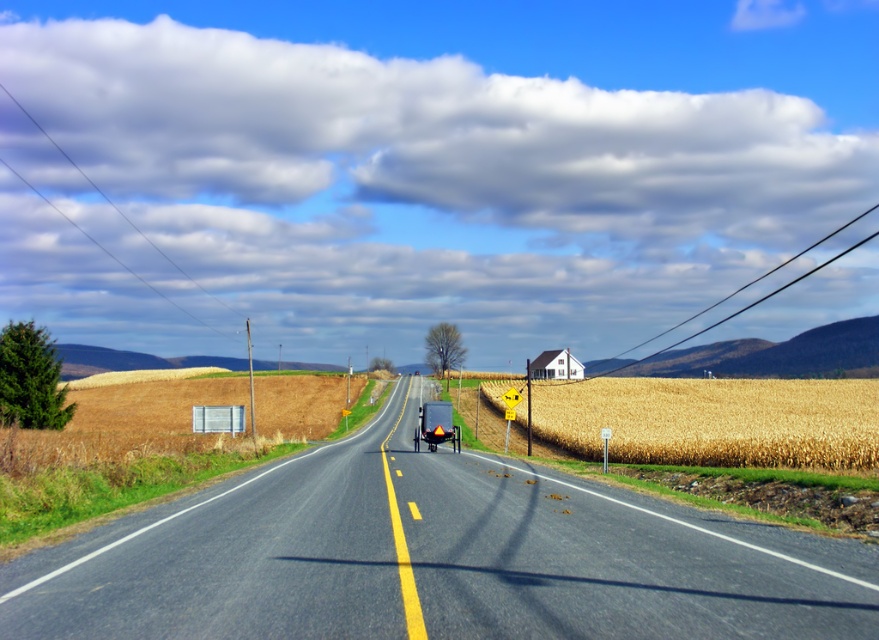
Describe the element at coordinates (434, 557) in the screenshot. The image size is (879, 640). I see `asphalt road at center` at that location.

Is point (379, 502) behind point (519, 420)?

No, it is in front of (519, 420).

You are a GUI agent. You are given a task and a screenshot of the screen. Output one action in this format:
    pyautogui.click(x=<x>, y=<y>)
    Task: Click on the asphalt road at center
    The height and width of the screenshot is (640, 879).
    Given the screenshot: What is the action you would take?
    pyautogui.click(x=434, y=557)

Can you confirm if golden grain field at right is bigger than matte black trailer truck at center?

Yes.

Between golden grain field at right and matte black trailer truck at center, which one has less height?

golden grain field at right

Where is `golden grain field at right`? golden grain field at right is located at coordinates (714, 420).

Identify the location of golden grain field at right. This screenshot has height=640, width=879. (714, 420).

Is point (759, 592) farther from viewer compared to point (456, 451)?

No.

Is asphalt road at center thinner than matte black trailer truck at center?

Incorrect, asphalt road at center's width is not less than matte black trailer truck at center's.

Is point (142, 561) less distant than point (426, 406)?

Yes, point (142, 561) is closer to viewer.

The width and height of the screenshot is (879, 640). In order to click on asphalt road at center in this screenshot , I will do `click(434, 557)`.